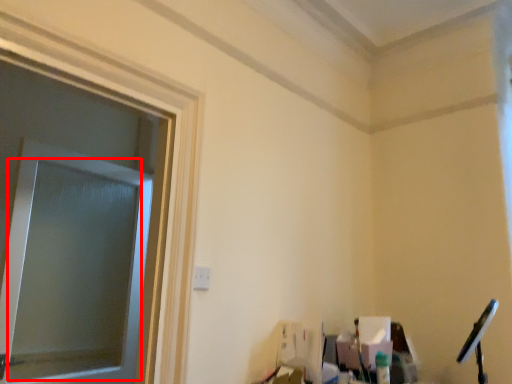
Question: From the image's perspective, where is window screen (annotated by the red box) located relative to window frame?

Choices:
 (A) above
 (B) below

Answer: (B)